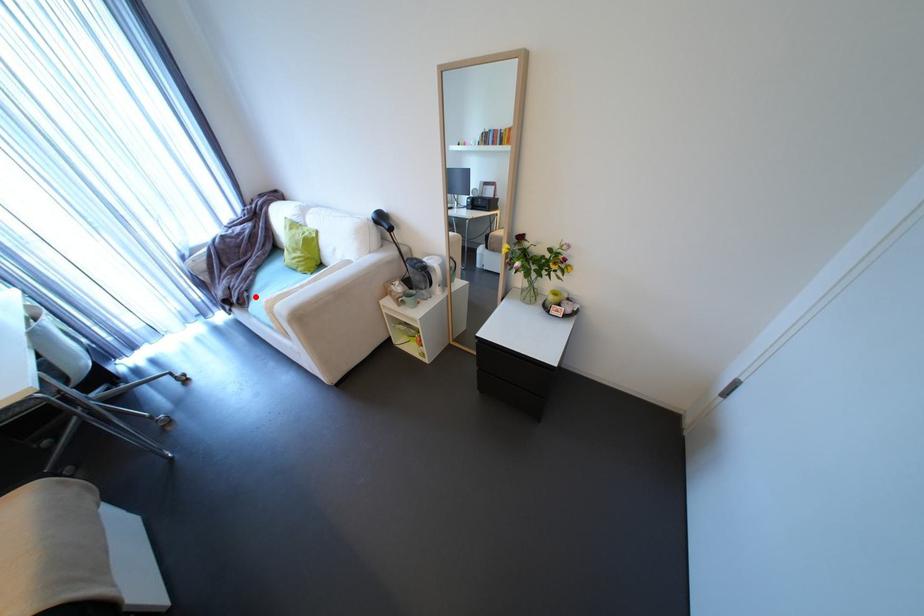
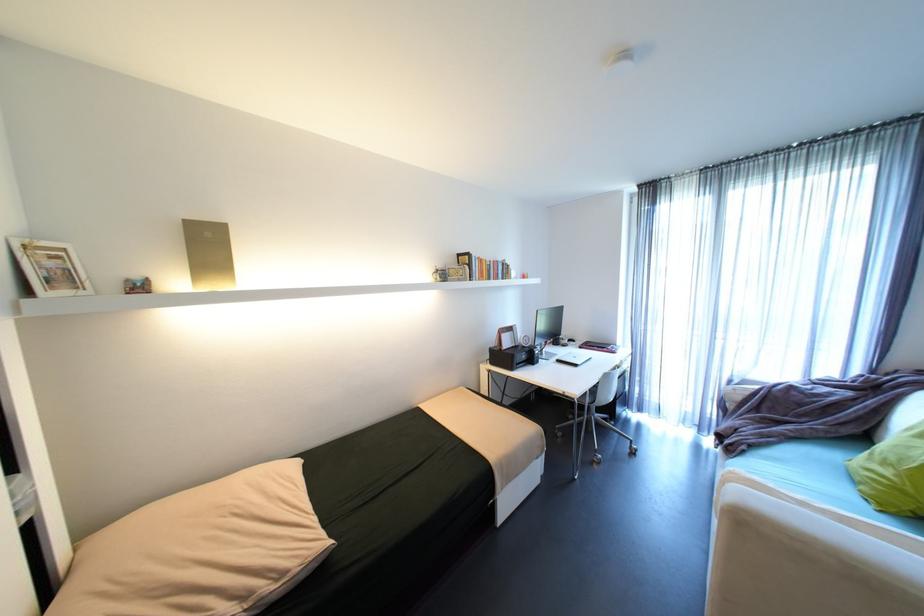
Find the pixel in the second image that matches the highlighted location in the first image.

(751, 451)